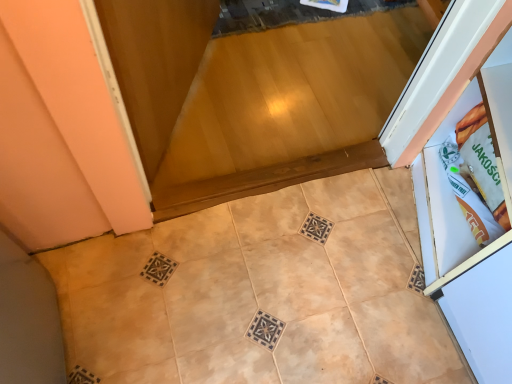
The height and width of the screenshot is (384, 512). In order to click on free spot below beige matte tile at center, placed as the first ceramic tile when sorted from left to right (from a real-world perspective) in this screenshot , I will do `click(220, 331)`.